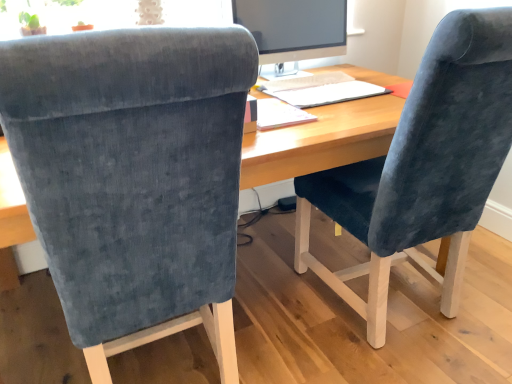
This screenshot has height=384, width=512. What are the coordinates of `wooden desk at center` in the screenshot? It's located at (321, 141).

What is the approximate height of velvet blue chair at center, which is counted as the 1th chair, starting from the left?

velvet blue chair at center, which is counted as the 1th chair, starting from the left, is 3.67 feet tall.

Image resolution: width=512 pixels, height=384 pixels. I want to click on velvet blue chair at right, the 2th chair viewed from the left, so click(x=423, y=167).

Image resolution: width=512 pixels, height=384 pixels. I want to click on matte black monitor at upper center, so point(294,29).

Locate an element on the screen. The width and height of the screenshot is (512, 384). wooden desk at center is located at coordinates (321, 141).

Consider the image. Choose the correct answer: Is white paper notepad at center inside velvet blue chair at right, the 2th chair viewed from the left, or outside it?

white paper notepad at center is not inside velvet blue chair at right, the 2th chair viewed from the left, it's outside.

In the scene shown: Is white paper notepad at center turned away from velvet blue chair at right, the 2th chair viewed from the left?

No, velvet blue chair at right, the 2th chair viewed from the left, is not at the back of white paper notepad at center.

How far apart are white paper notepad at center and velvet blue chair at right, which is the first chair from right to left?

white paper notepad at center and velvet blue chair at right, which is the first chair from right to left, are 18.81 inches apart from each other.

From the image's perspective, between velvet blue chair at center, the second chair viewed from the right, and white paper notepad at center, who is located below?

From the image's view, velvet blue chair at center, the second chair viewed from the right, is below.

Looking at this image, is the position of velvet blue chair at center, which is counted as the 1th chair, starting from the left, less distant than that of white paper notepad at center?

Yes, velvet blue chair at center, which is counted as the 1th chair, starting from the left, is closer to the viewer.

From a real-world perspective, which is physically below, velvet blue chair at center, which is counted as the 1th chair, starting from the left, or white paper notepad at center?

velvet blue chair at center, which is counted as the 1th chair, starting from the left, is physically lower.

Does point (133, 120) come behind point (284, 105)?

No, (133, 120) is closer to viewer.

Where is `desk in front of the matte black monitor at upper center`? desk in front of the matte black monitor at upper center is located at coordinates (321, 141).

Is wooden desk at center at the back of matte black monitor at upper center?

No, matte black monitor at upper center is not facing the opposite direction of wooden desk at center.

Looking at the image, does matte black monitor at upper center seem bigger or smaller compared to wooden desk at center?

Clearly, matte black monitor at upper center is smaller in size than wooden desk at center.

From the image's perspective, does matte black monitor at upper center appear lower than wooden desk at center?

No, from the image's perspective, matte black monitor at upper center is not beneath wooden desk at center.

Based on the photo, looking at their sizes, would you say velvet blue chair at right, the 2th chair viewed from the left, is wider or thinner than velvet blue chair at center, the second chair viewed from the right?

Considering their sizes, velvet blue chair at right, the 2th chair viewed from the left, looks broader than velvet blue chair at center, the second chair viewed from the right.

From the image's perspective, who appears lower, velvet blue chair at right, which is the first chair from right to left, or velvet blue chair at center, which is counted as the 1th chair, starting from the left?

velvet blue chair at center, which is counted as the 1th chair, starting from the left, appears lower in the image.

Is velvet blue chair at right, the 2th chair viewed from the left, to the right of velvet blue chair at center, which is counted as the 1th chair, starting from the left, from the viewer's perspective?

Yes, velvet blue chair at right, the 2th chair viewed from the left, is to the right of velvet blue chair at center, which is counted as the 1th chair, starting from the left.

Could you measure the distance between velvet blue chair at right, the 2th chair viewed from the left, and velvet blue chair at center, the second chair viewed from the right?

The distance of velvet blue chair at right, the 2th chair viewed from the left, from velvet blue chair at center, the second chair viewed from the right, is 25.42 inches.

Is velvet blue chair at center, which is counted as the 1th chair, starting from the left, inside white paper notepad at center?

No, velvet blue chair at center, which is counted as the 1th chair, starting from the left, is not inside white paper notepad at center.

Considering the relative sizes of white paper notepad at center and velvet blue chair at center, which is counted as the 1th chair, starting from the left, in the image provided, is white paper notepad at center bigger than velvet blue chair at center, which is counted as the 1th chair, starting from the left,?

Incorrect, white paper notepad at center is not larger than velvet blue chair at center, which is counted as the 1th chair, starting from the left.

From a real-world perspective, who is located lower, white paper notepad at center or velvet blue chair at center, which is counted as the 1th chair, starting from the left?

In real-world perspective, velvet blue chair at center, which is counted as the 1th chair, starting from the left, is lower.

Which is closer to the camera, (309,118) or (120,64)?

Positioned in front is point (120,64).

Between velvet blue chair at right, which is the first chair from right to left, and wooden desk at center, which one has smaller size?

velvet blue chair at right, which is the first chair from right to left.

Is velvet blue chair at right, which is the first chair from right to left, oriented away from wooden desk at center?

Yes, wooden desk at center is at the back of velvet blue chair at right, which is the first chair from right to left.

Is point (376, 254) farther from viewer compared to point (13, 181)?

Yes, it is.

From the picture: Is wooden desk at center aimed at velvet blue chair at right, the 2th chair viewed from the left?

Yes, wooden desk at center faces towards velvet blue chair at right, the 2th chair viewed from the left.

Can velvet blue chair at right, which is the first chair from right to left, be found inside wooden desk at center?

Indeed, velvet blue chair at right, which is the first chair from right to left, is located within wooden desk at center.

From a real-world perspective, who is located lower, wooden desk at center or velvet blue chair at right, which is the first chair from right to left?

wooden desk at center, from a real-world perspective.

Is point (374, 138) closer to viewer compared to point (437, 48)?

No, (374, 138) is further to viewer.

Where is `chair that appears on the right of white paper notepad at center`? chair that appears on the right of white paper notepad at center is located at coordinates (x=423, y=167).

Identify the location of chair that is on the left side of white paper notepad at center. (133, 177).

When comparing their distances from wooden desk at center, does velvet blue chair at center, which is counted as the 1th chair, starting from the left, or white paper notepad at center seem further?

Based on the image, velvet blue chair at center, which is counted as the 1th chair, starting from the left, appears to be further to wooden desk at center.

Looking at this image, based on their spatial positions, is white paper notepad at center or matte black monitor at upper center closer to velvet blue chair at right, the 2th chair viewed from the left?

white paper notepad at center lies closer to velvet blue chair at right, the 2th chair viewed from the left, than the other object.

When comparing their distances from velvet blue chair at center, the second chair viewed from the right, does wooden desk at center or white paper notepad at center seem closer?

The object closer to velvet blue chair at center, the second chair viewed from the right, is wooden desk at center.

Considering their positions, is velvet blue chair at center, the second chair viewed from the right, positioned further to white paper notepad at center than wooden desk at center?

velvet blue chair at center, the second chair viewed from the right, is further to white paper notepad at center.

When comparing their distances from wooden desk at center, does white paper notepad at center or velvet blue chair at right, the 2th chair viewed from the left, seem closer?

white paper notepad at center is positioned closer to the anchor wooden desk at center.

Looking at the image, which one is located further to velvet blue chair at right, the 2th chair viewed from the left, wooden desk at center or velvet blue chair at center, which is counted as the 1th chair, starting from the left?

velvet blue chair at center, which is counted as the 1th chair, starting from the left.

Considering their positions, is velvet blue chair at right, the 2th chair viewed from the left, positioned closer to matte black monitor at upper center than velvet blue chair at center, which is counted as the 1th chair, starting from the left?

The object closer to matte black monitor at upper center is velvet blue chair at right, the 2th chair viewed from the left.

When comparing their distances from matte black monitor at upper center, does wooden desk at center or velvet blue chair at center, the second chair viewed from the right, seem further?

Based on the image, velvet blue chair at center, the second chair viewed from the right, appears to be further to matte black monitor at upper center.

Locate an element on the screen. notepad between velvet blue chair at right, which is the first chair from right to left, and matte black monitor at upper center in the front-back direction is located at coordinates (279, 114).

This screenshot has height=384, width=512. What are the coordinates of `notepad positioned between velvet blue chair at center, the second chair viewed from the right, and matte black monitor at upper center from near to far` in the screenshot? It's located at (279, 114).

Find the location of a particular element. notepad between velvet blue chair at center, which is counted as the 1th chair, starting from the left, and velvet blue chair at right, which is the first chair from right to left is located at coordinates (279, 114).

Locate an element on the screen. chair between velvet blue chair at center, which is counted as the 1th chair, starting from the left, and matte black monitor at upper center from front to back is located at coordinates (423, 167).